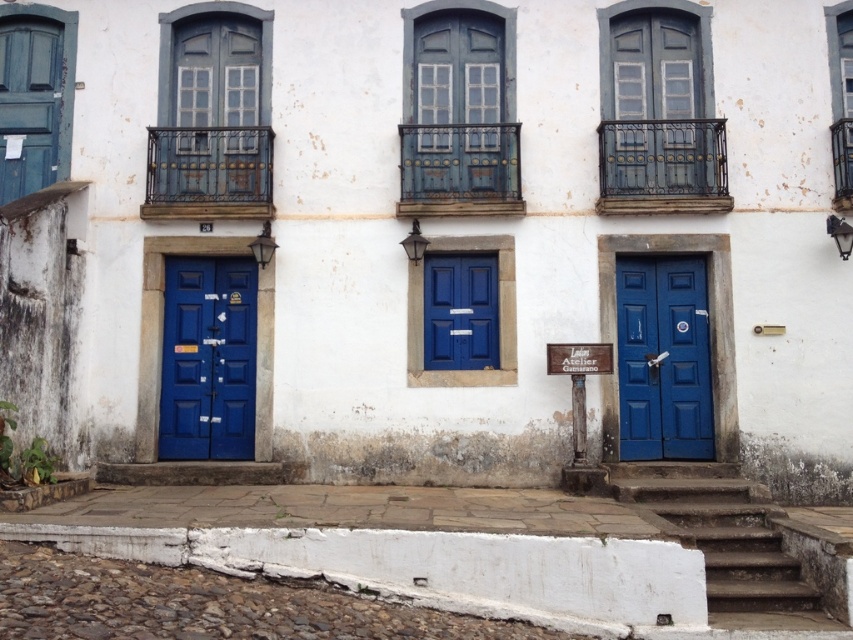
You are standing at a point 10.15 meters away from the point labeled as point (698, 328) in the scene. If you want to take a photo of the building, would you need to move closer or farther away to ensure the entire building fits in the frame?

Since you are 10.15 meters away from point (698, 328), you should move farther away to ensure the entire building fits in the frame.

You are standing in front of the building and want to enter through the doors. According to the image, which door is positioned lower, the matte blue door at right or the matte blue door at center?

The matte blue door at right is positioned lower than the matte blue door at center because it is described as being below it.